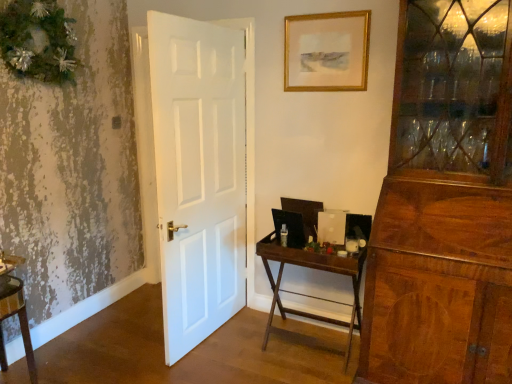
What do you see at coordinates (316, 269) in the screenshot? This screenshot has height=384, width=512. I see `wooden folding table at center` at bounding box center [316, 269].

At what (x,y) coordinates should I click in order to perform the action: click on wooden vanity at lower left. Please return your answer as a coordinate pair (x, y). This screenshot has height=384, width=512. Looking at the image, I should click on (14, 310).

Which object is further away from the camera taking this photo, wooden folding table at center or green textured wreath at upper left?

wooden folding table at center is behind.

Between wooden folding table at center and green textured wreath at upper left, which one has more height?

With more height is wooden folding table at center.

Is wooden folding table at center not within green textured wreath at upper left?

Yes, wooden folding table at center is located beyond the bounds of green textured wreath at upper left.

Does point (285, 311) lie behind point (22, 304)?

That is True.

Looking at this image, looking at the image, does wooden folding table at center seem bigger or smaller compared to wooden vanity at lower left?

In the image, wooden folding table at center appears to be larger than wooden vanity at lower left.

Between wooden folding table at center and wooden vanity at lower left, which one has larger width?

wooden folding table at center is wider.

In the scene shown: Is wooden folding table at center oriented towards wooden vanity at lower left?

No.

Could you tell me if gold-framed picture at upper center is turned towards wooden vanity at lower left?

No, gold-framed picture at upper center is not oriented towards wooden vanity at lower left.

Is gold-framed picture at upper center wider or thinner than wooden vanity at lower left?

In the image, gold-framed picture at upper center appears to be more narrow than wooden vanity at lower left.

Which object is closer to the camera taking this photo, gold-framed picture at upper center or wooden vanity at lower left?

wooden vanity at lower left is in front.

From the picture: Can you confirm if wooden vanity at lower left is thinner than green textured wreath at upper left?

No.

Can you confirm if wooden vanity at lower left is taller than green textured wreath at upper left?

Yes.

Image resolution: width=512 pixels, height=384 pixels. In order to click on vanity below the green textured wreath at upper left (from a real-world perspective) in this screenshot , I will do `click(14, 310)`.

From a real-world perspective, between wooden vanity at lower left and green textured wreath at upper left, who is vertically lower?

wooden vanity at lower left is physically lower.

Is wooden vanity at lower left positioned with its back to wooden folding table at center?

That's not correct — wooden vanity at lower left is not looking away from wooden folding table at center.

Which is closer, (11, 306) or (328, 257)?

Point (11, 306)

From the picture: Is wooden vanity at lower left located outside wooden folding table at center?

Yes, wooden vanity at lower left is located beyond the bounds of wooden folding table at center.

Considering the sizes of objects wooden vanity at lower left and gold-framed picture at upper center in the image provided, who is thinner, wooden vanity at lower left or gold-framed picture at upper center?

gold-framed picture at upper center.

From a real-world perspective, is wooden vanity at lower left located higher than gold-framed picture at upper center?

No, from a real-world perspective, wooden vanity at lower left is not above gold-framed picture at upper center.

Does point (1, 268) appear closer or farther from the camera than point (366, 84)?

Point (1, 268) is closer to the camera than point (366, 84).

In the image, is wooden vanity at lower left positioned in front of or behind gold-framed picture at upper center?

In the image, wooden vanity at lower left appears in front of gold-framed picture at upper center.

Locate an element on the screen. The height and width of the screenshot is (384, 512). picture frame below the green textured wreath at upper left (from a real-world perspective) is located at coordinates (327, 51).

Is gold-framed picture at upper center far away from green textured wreath at upper left?

gold-framed picture at upper center is far away from green textured wreath at upper left.

From the image's perspective, is gold-framed picture at upper center located beneath green textured wreath at upper left?

Correct, gold-framed picture at upper center appears lower than green textured wreath at upper left in the image.

You are a GUI agent. You are given a task and a screenshot of the screen. Output one action in this format:
    pyautogui.click(x=<x>, y=<y>)
    Task: Click on the table below the green textured wreath at upper left (from the image's perspective)
    
    Given the screenshot: What is the action you would take?
    pyautogui.click(x=316, y=269)

Where is `table that is above the wooden vanity at lower left (from a real-world perspective)`? This screenshot has width=512, height=384. table that is above the wooden vanity at lower left (from a real-world perspective) is located at coordinates (316, 269).

Based on their spatial positions, is green textured wreath at upper left or wooden folding table at center closer to gold-framed picture at upper center?

wooden folding table at center is closer to gold-framed picture at upper center.

Looking at the image, which one is located further to wooden folding table at center, wooden vanity at lower left or green textured wreath at upper left?

green textured wreath at upper left is positioned further to the anchor wooden folding table at center.

Which object lies further to the anchor point wooden vanity at lower left, wooden folding table at center or green textured wreath at upper left?

wooden folding table at center is further to wooden vanity at lower left.

Based on the photo, which object lies further to the anchor point wooden folding table at center, wooden vanity at lower left or gold-framed picture at upper center?

wooden vanity at lower left lies further to wooden folding table at center than the other object.

Estimate the real-world distances between objects in this image. Which object is further from wooden vanity at lower left, green textured wreath at upper left or gold-framed picture at upper center?

The object further to wooden vanity at lower left is gold-framed picture at upper center.

When comparing their distances from wooden vanity at lower left, does gold-framed picture at upper center or green textured wreath at upper left seem closer?

The object closer to wooden vanity at lower left is green textured wreath at upper left.

Looking at the image, which one is located further to wooden folding table at center, gold-framed picture at upper center or green textured wreath at upper left?

The object further to wooden folding table at center is green textured wreath at upper left.

From the image, which object appears to be nearer to green textured wreath at upper left, wooden vanity at lower left or gold-framed picture at upper center?

wooden vanity at lower left lies closer to green textured wreath at upper left than the other object.

Where is `table between green textured wreath at upper left and gold-framed picture at upper center from left to right`? This screenshot has width=512, height=384. table between green textured wreath at upper left and gold-framed picture at upper center from left to right is located at coordinates (316, 269).

Find the location of a particular element. The image size is (512, 384). table located between wooden vanity at lower left and gold-framed picture at upper center in the left-right direction is located at coordinates (316, 269).

You are a GUI agent. You are given a task and a screenshot of the screen. Output one action in this format:
    pyautogui.click(x=<x>, y=<y>)
    Task: Click on the christmas decoration between wooden vanity at lower left and gold-framed picture at upper center from left to right
    This screenshot has width=512, height=384.
    Given the screenshot: What is the action you would take?
    pyautogui.click(x=38, y=41)

At what (x,y) coordinates should I click in order to perform the action: click on christmas decoration located between wooden vanity at lower left and wooden folding table at center in the left-right direction. Please return your answer as a coordinate pair (x, y). Image resolution: width=512 pixels, height=384 pixels. Looking at the image, I should click on (38, 41).